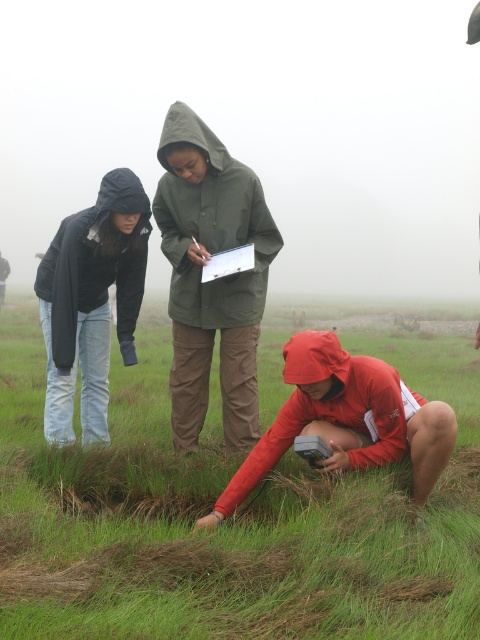
Is green matte raincoat at center closer to the viewer compared to red matte jacket at lower right?

No, it is behind red matte jacket at lower right.

Is point (191, 248) farther from viewer compared to point (335, 352)?

Yes, point (191, 248) is farther from viewer.

Between point (228, 298) and point (407, 444), which one is positioned behind?

Positioned behind is point (228, 298).

Where is `green matte raincoat at center`? This screenshot has width=480, height=640. green matte raincoat at center is located at coordinates (214, 280).

In the scene shown: Who is positioned more to the left, green grassy at center or matte black jacket at left?

From the viewer's perspective, matte black jacket at left appears more on the left side.

Which is behind, point (192, 481) or point (44, 326)?

The point (44, 326) is behind.

Who is more forward, (375, 480) or (98, 305)?

Point (375, 480) is in front.

The image size is (480, 640). In order to click on green grassy at center in this screenshot , I will do `click(228, 516)`.

Does green matte raincoat at center have a greater width compared to matte black jacket at left?

No.

In the scene shown: Who is positioned more to the left, green matte raincoat at center or matte black jacket at left?

Positioned to the left is matte black jacket at left.

Between point (242, 348) and point (88, 284), which one is positioned behind?

The point (88, 284) is more distant.

Identify the location of green matte raincoat at center. (214, 280).